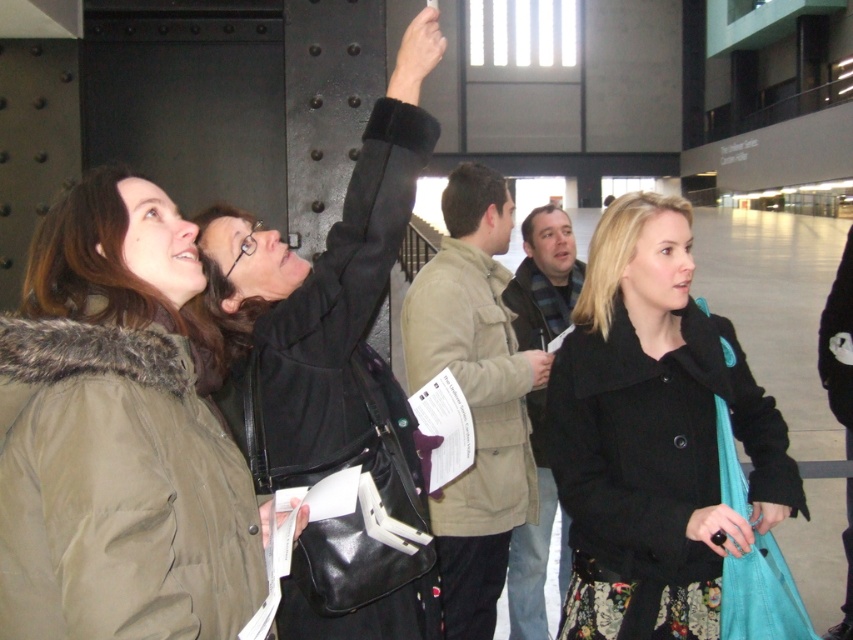
Which is below, khaki fur-trimmed coat at upper left or black matte coat at center?

black matte coat at center is lower down.

Between khaki fur-trimmed coat at upper left and black matte coat at center, which one has less height?

khaki fur-trimmed coat at upper left

What are the coordinates of `khaki fur-trimmed coat at upper left` in the screenshot? It's located at (119, 433).

Image resolution: width=853 pixels, height=640 pixels. I want to click on khaki fur-trimmed coat at upper left, so click(119, 433).

Image resolution: width=853 pixels, height=640 pixels. Identify the location of khaki fur-trimmed coat at upper left. (119, 433).

Between point (22, 483) and point (384, 188), which one is positioned behind?

The point (384, 188) is more distant.

This screenshot has height=640, width=853. What do you see at coordinates (119, 433) in the screenshot?
I see `khaki fur-trimmed coat at upper left` at bounding box center [119, 433].

You are a GUI agent. You are given a task and a screenshot of the screen. Output one action in this format:
    pyautogui.click(x=<x>, y=<y>)
    Task: Click on the khaki fur-trimmed coat at upper left
    
    Given the screenshot: What is the action you would take?
    coord(119,433)

Does black matte coat at center have a greater height compared to matte black jacket at upper center?

Yes.

Which is behind, point (766, 449) or point (408, 150)?

Point (766, 449)

This screenshot has height=640, width=853. I want to click on black matte coat at center, so click(x=654, y=436).